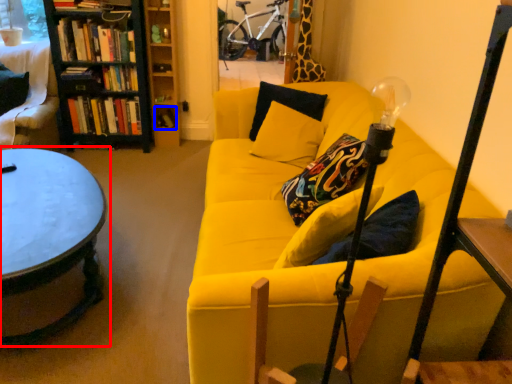
Question: Which object appears closest to the camera in this image, coffee table (highlighted by a red box) or book (highlighted by a blue box)?

Choices:
 (A) coffee table
 (B) book

Answer: (A)